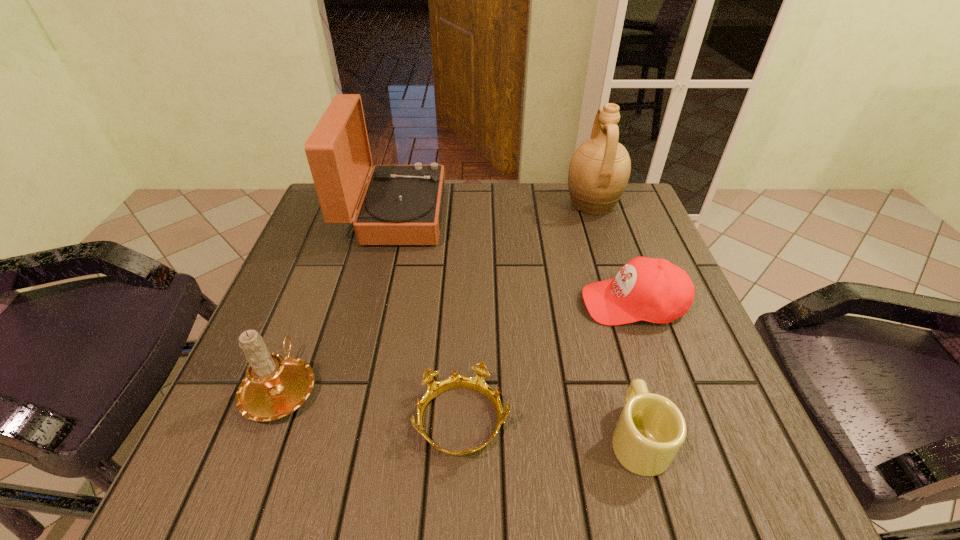
Find the location of a particular element. The image size is (960, 540). vacant area that lies between the phonograph record and the third farthest object is located at coordinates (x=514, y=259).

Identify which object is located as the third nearest to the phonograph record. Please provide its 2D coordinates. Your answer should be formatted as a tuple, i.e. [(x, y)], where the tuple contains the x and y coordinates of a point satisfying the conditions above.

[(654, 290)]

Where is `object that stands as the fourth closest to the mug`? This screenshot has width=960, height=540. object that stands as the fourth closest to the mug is located at coordinates (402, 204).

Where is `vacant space that satisfies the following two spatial constraints: 1. on the face of the phonograph record; 2. on the front side of the candle`? This screenshot has width=960, height=540. vacant space that satisfies the following two spatial constraints: 1. on the face of the phonograph record; 2. on the front side of the candle is located at coordinates (352, 387).

The height and width of the screenshot is (540, 960). Identify the location of blank space that satisfies the following two spatial constraints: 1. with the handle on the side of the mug; 2. on the face of the phonograph record. pyautogui.click(x=576, y=215).

Locate an element on the screen. free space that satisfies the following two spatial constraints: 1. with the handle on the side of the fifth tallest object; 2. on the face of the phonograph record is located at coordinates (576, 215).

Identify the location of free space that satisfies the following two spatial constraints: 1. on the face of the phonograph record; 2. on the back side of the shortest object. The width and height of the screenshot is (960, 540). (344, 421).

Find the location of a particular element. free space that satisfies the following two spatial constraints: 1. on the face of the shortest object; 2. on the right side of the phonograph record is located at coordinates (344, 421).

Where is `vacant area that satisfies the following two spatial constraints: 1. on the face of the phonograph record; 2. on the back side of the crown`? Image resolution: width=960 pixels, height=540 pixels. vacant area that satisfies the following two spatial constraints: 1. on the face of the phonograph record; 2. on the back side of the crown is located at coordinates (344, 421).